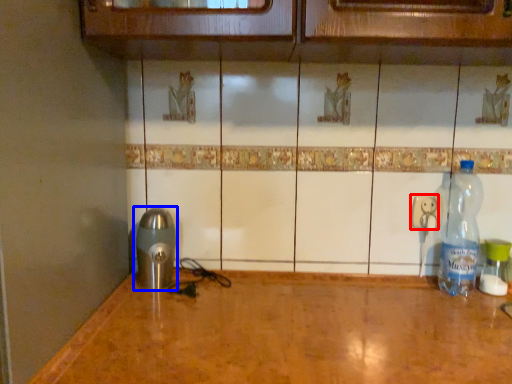
Question: Which point is further to the camera, electric outlet (highlighted by a red box) or appliance (highlighted by a blue box)?

Choices:
 (A) electric outlet
 (B) appliance

Answer: (A)